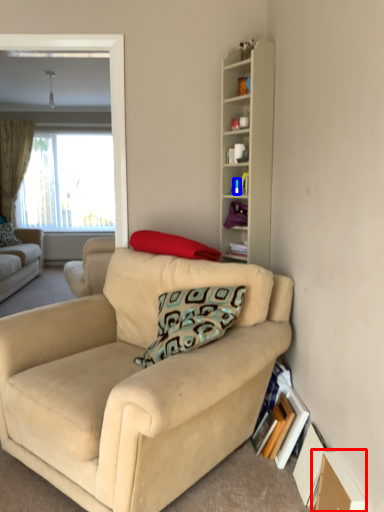
Question: Which object appears farthest to the camera in this image, cardboard box (highlighted by a red box) or teal (highlighted by a blue box)?

Choices:
 (A) cardboard box
 (B) teal

Answer: (B)